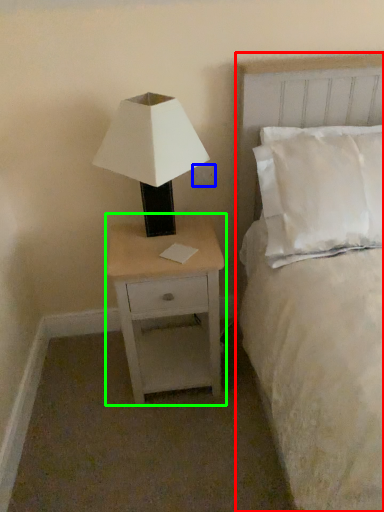
Question: Which object is positioned farthest from bed (highlighted by a red box)? Select from electric outlet (highlighted by a blue box) and nightstand (highlighted by a green box).

Choices:
 (A) electric outlet
 (B) nightstand

Answer: (A)